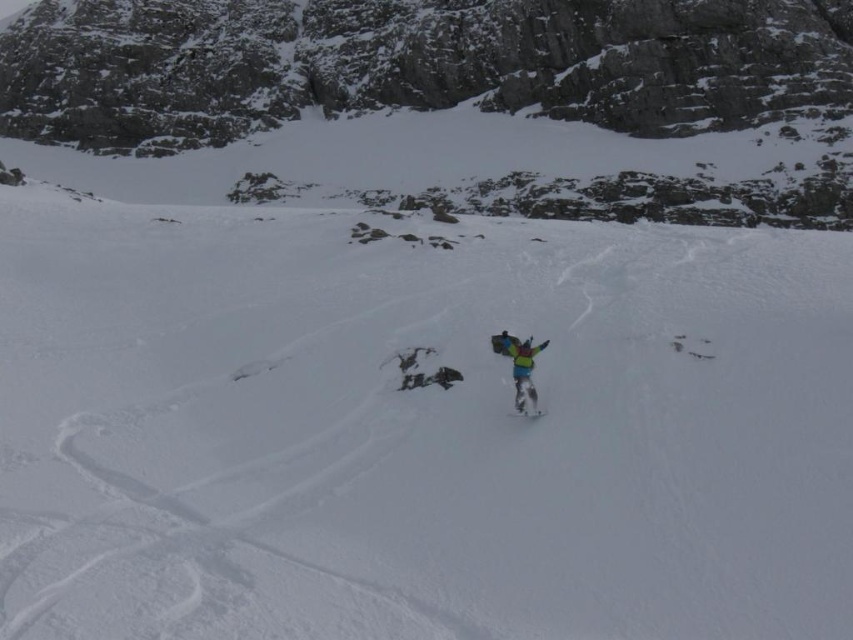
Question: Can you confirm if white matte snow at center is positioned below multicolored fabric snowboarder at center?

Choices:
 (A) yes
 (B) no

Answer: (B)

Question: Which point appears closest to the camera in this image?

Choices:
 (A) (462, 45)
 (B) (534, 410)
 (C) (642, 440)

Answer: (C)

Question: Does rocky gray mountain at center have a smaller size compared to white matte snowboard at center?

Choices:
 (A) yes
 (B) no

Answer: (B)

Question: Which point appears closest to the camera in this image?

Choices:
 (A) (526, 406)
 (B) (74, 29)
 (C) (799, 353)
 (D) (532, 403)

Answer: (D)

Question: Does white matte snow at center come behind multicolored fabric snowboarder at center?

Choices:
 (A) no
 (B) yes

Answer: (A)

Question: Which object is the farthest from the white matte snowboard at center?

Choices:
 (A) white matte snow at center
 (B) rocky gray mountain at center

Answer: (B)